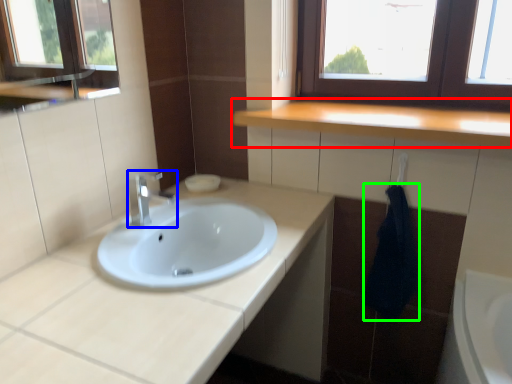
Question: Which object is the closest to the countertop (highlighted by a red box)? Choose among these: tap (highlighted by a blue box) or bath towel (highlighted by a green box).

Choices:
 (A) tap
 (B) bath towel

Answer: (B)